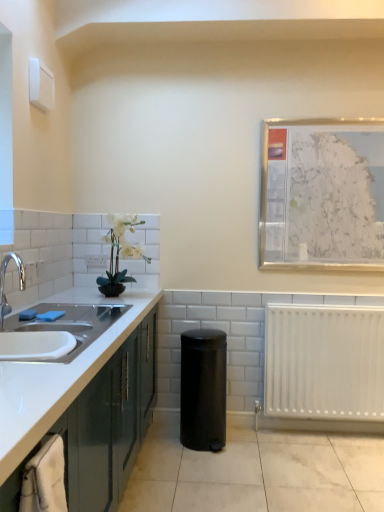
Question: Is white plastic electric outlet at upper left aimed at white plastic radiator at lower right?

Choices:
 (A) yes
 (B) no

Answer: (B)

Question: Does white plastic electric outlet at upper left lie behind white plastic radiator at lower right?

Choices:
 (A) no
 (B) yes

Answer: (B)

Question: Considering the relative sizes of white plastic electric outlet at upper left and white plastic radiator at lower right in the image provided, is white plastic electric outlet at upper left smaller than white plastic radiator at lower right?

Choices:
 (A) yes
 (B) no

Answer: (A)

Question: From the image's perspective, does white plastic electric outlet at upper left appear higher than white plastic radiator at lower right?

Choices:
 (A) yes
 (B) no

Answer: (A)

Question: Is white plastic radiator at lower right a part of white plastic electric outlet at upper left?

Choices:
 (A) no
 (B) yes

Answer: (A)

Question: Is white plastic electric outlet at upper left to the left of white plastic radiator at lower right from the viewer's perspective?

Choices:
 (A) yes
 (B) no

Answer: (A)

Question: Does white ceramic sink at left have a smaller size compared to white plastic electric outlet at upper left?

Choices:
 (A) no
 (B) yes

Answer: (A)

Question: From the image's perspective, is white ceramic sink at left located beneath white plastic electric outlet at upper left?

Choices:
 (A) no
 (B) yes

Answer: (B)

Question: Is white ceramic sink at left to the right of white plastic electric outlet at upper left from the viewer's perspective?

Choices:
 (A) no
 (B) yes

Answer: (B)

Question: From the image's perspective, is white ceramic sink at left above white plastic electric outlet at upper left?

Choices:
 (A) yes
 (B) no

Answer: (B)

Question: From a real-world perspective, is white ceramic sink at left beneath white plastic electric outlet at upper left?

Choices:
 (A) no
 (B) yes

Answer: (B)

Question: Can you confirm if white ceramic sink at left is thinner than white plastic electric outlet at upper left?

Choices:
 (A) no
 (B) yes

Answer: (A)

Question: From a real-world perspective, is white plastic radiator at lower right positioned under metallic silver map at upper right based on gravity?

Choices:
 (A) yes
 (B) no

Answer: (A)